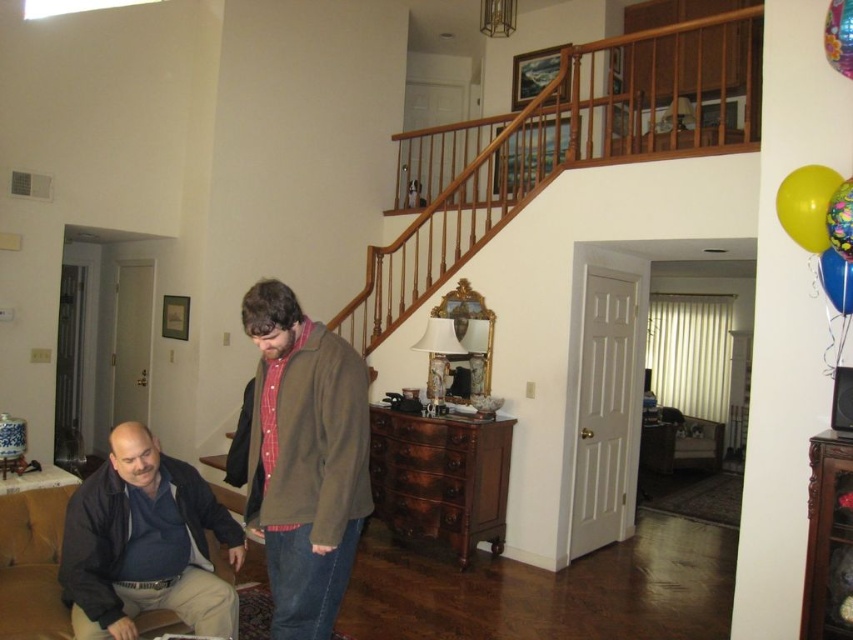
This screenshot has height=640, width=853. What do you see at coordinates (805, 204) in the screenshot? I see `yellow rubber balloon at upper right` at bounding box center [805, 204].

Is point (792, 173) farther from camera compared to point (834, 200)?

Yes, it is behind point (834, 200).

Image resolution: width=853 pixels, height=640 pixels. Find the location of `yellow rubber balloon at upper right`. yellow rubber balloon at upper right is located at coordinates click(x=805, y=204).

At what (x,y) coordinates should I click in order to perform the action: click on shiny metallic balloon at upper right. Please return your answer as a coordinate pair (x, y). Looking at the image, I should click on (839, 36).

Does point (833, 61) come behind point (848, 180)?

Yes.

Locate an element on the screen. shiny metallic balloon at upper right is located at coordinates (839, 36).

Looking at this image, does brown woolen sweater at center have a greater height compared to shiny metallic balloon at upper right?

Yes.

Where is `brown woolen sweater at center`? This screenshot has height=640, width=853. brown woolen sweater at center is located at coordinates (305, 458).